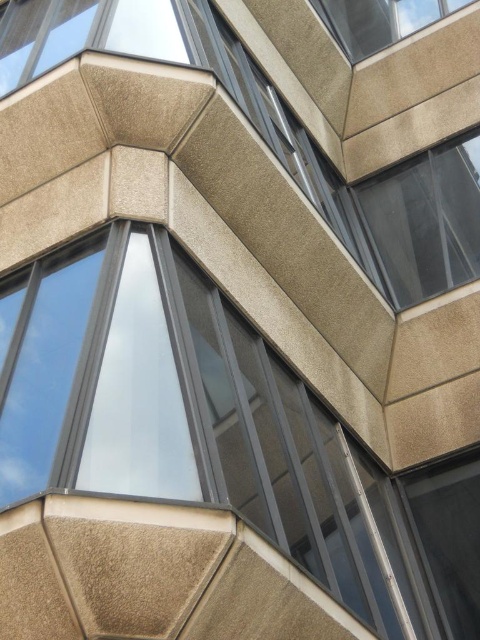
Question: Is clear glass window at center to the right of slate gray concrete window at upper right from the viewer's perspective?

Choices:
 (A) no
 (B) yes

Answer: (A)

Question: Can you confirm if clear glass window at center is bigger than slate gray concrete window at upper right?

Choices:
 (A) yes
 (B) no

Answer: (A)

Question: Which point is closer to the camera?

Choices:
 (A) (105, 452)
 (B) (428, 193)
 (C) (363, 38)

Answer: (A)

Question: Does transparent glass window at upper right have a smaller size compared to slate gray concrete window at upper right?

Choices:
 (A) yes
 (B) no

Answer: (B)

Question: Considering the real-world distances, which object is closest to the transparent glass window at upper right?

Choices:
 (A) slate gray concrete window at upper right
 (B) clear glass window at center

Answer: (B)

Question: Which point is farther to the camera?

Choices:
 (A) (144, 470)
 (B) (404, 276)

Answer: (B)